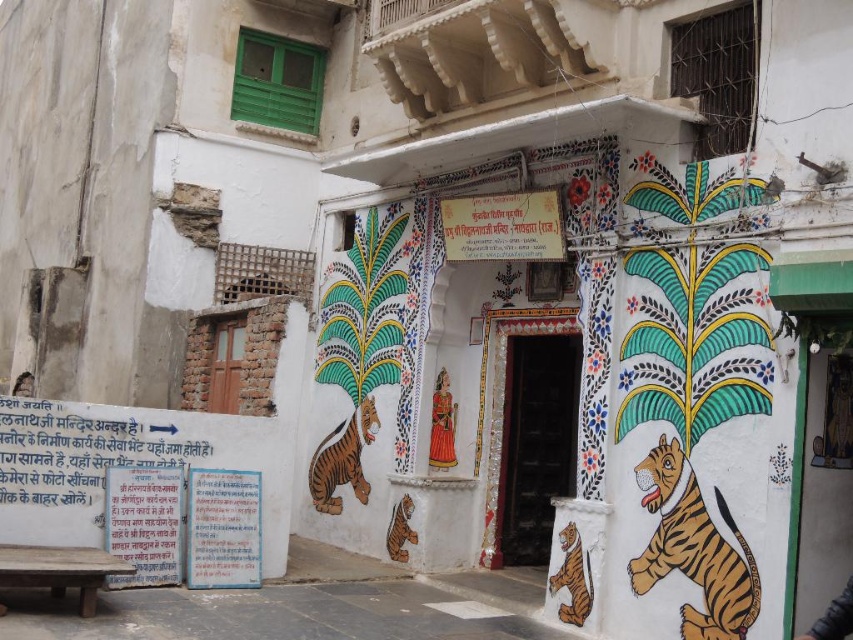
Based on the photo, you are an architect examining the temple facade. You notice the polished wood statue at center and the smooth skin face at lower left. Which object is taller?

The polished wood statue at center is taller than the smooth skin face at lower left according to the description.

You are an architect visiting this traditional Indian building. You notice the polished wood statue at center and the smooth skin face at lower left. Which of these two objects appears to be smaller in size?

The polished wood statue at center is smaller than the smooth skin face at lower left, so the statue appears smaller.

From the picture: You are an architect analyzing the facade of this traditional Indian building. You notice the polished wood statue at center and the smooth skin face at lower left. Which object occupies more horizontal space on the facade?

The smooth skin face at lower left occupies more horizontal space because it has a greater width than the polished wood statue at center.